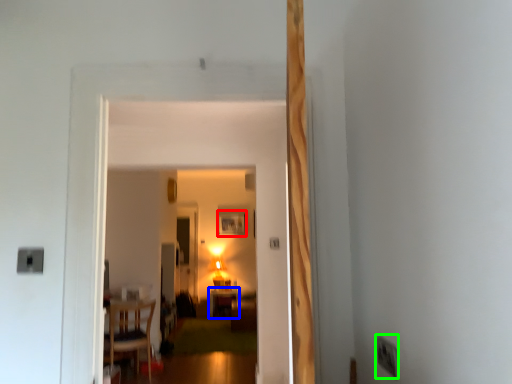
Question: Which is nearer to the picture frame (highlighted by a red box)? table (highlighted by a blue box) or electric outlet (highlighted by a green box).

Choices:
 (A) table
 (B) electric outlet

Answer: (A)